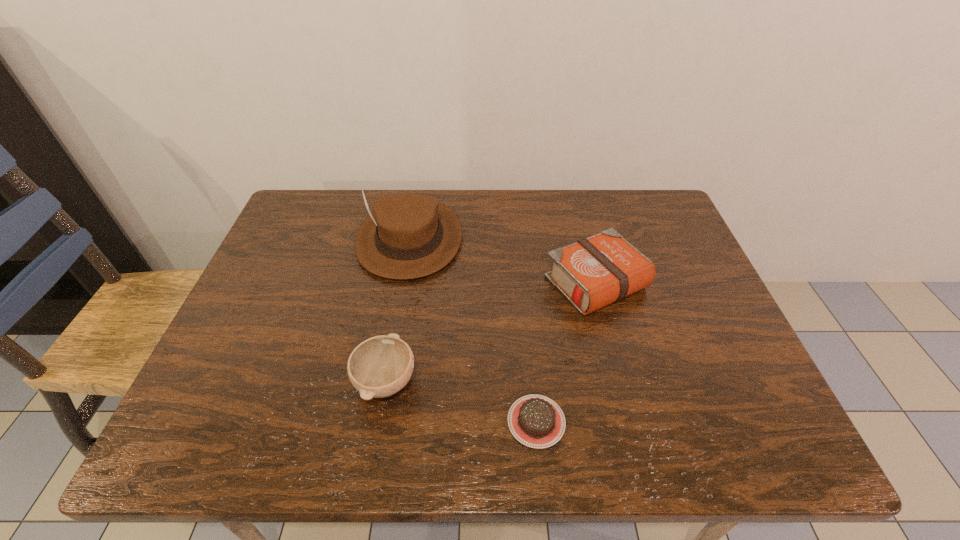
The image size is (960, 540). Identify the location of object that is the third closest one to the tallest object. (536, 421).

The height and width of the screenshot is (540, 960). Identify the location of vacant space that satisfies the following two spatial constraints: 1. on the back side of the Bible; 2. on the right side of the bowl. (402, 284).

What are the coordinates of `blank area in the image that satisfies the following two spatial constraints: 1. on the feather side of the fedora; 2. on the left side of the bowl` in the screenshot? It's located at (385, 381).

At what (x,y) coordinates should I click in order to perform the action: click on blank area in the image that satisfies the following two spatial constraints: 1. on the feather side of the tallest object; 2. on the right side of the chocolate cake. Please return your answer as a coordinate pair (x, y). Looking at the image, I should click on (378, 421).

Locate an element on the screen. The image size is (960, 540). free space that satisfies the following two spatial constraints: 1. on the feather side of the Bible; 2. on the left side of the fedora is located at coordinates (402, 284).